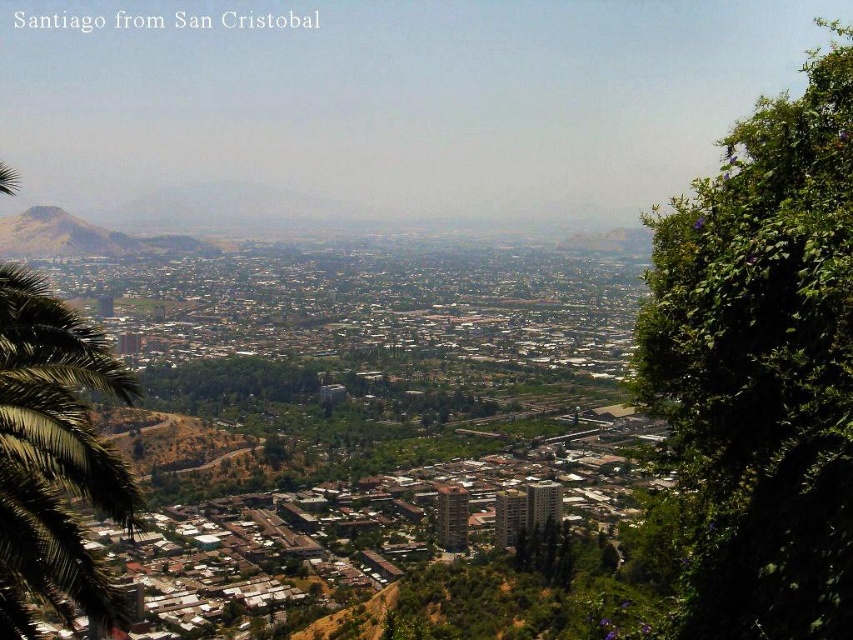
Is green leafy palm tree at left bigger than rustic brown hill at left?

Yes.

Is point (94, 460) in front of point (74, 246)?

Yes.

Describe the element at coordinates (53, 456) in the screenshot. I see `green leafy palm tree at left` at that location.

Locate an element on the screen. This screenshot has height=640, width=853. green leafy palm tree at left is located at coordinates (53, 456).

Does point (751, 576) lie behind point (21, 612)?

No, (751, 576) is closer to viewer.

At what (x,y) coordinates should I click in order to perform the action: click on green leafy tree at right. Please return your answer as a coordinate pair (x, y). This screenshot has height=640, width=853. Looking at the image, I should click on (761, 365).

Can you confirm if green leafy tree at right is positioned above rustic brown hill at left?

No.

Measure the distance between green leafy tree at right and rustic brown hill at left.

The distance of green leafy tree at right from rustic brown hill at left is 300.79 meters.

Between point (738, 518) and point (47, 246), which one is positioned in front?

Point (738, 518)

Find the location of a particular element. The image size is (853, 640). green leafy tree at right is located at coordinates (761, 365).